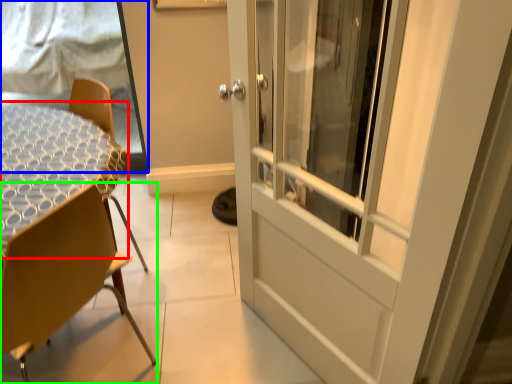
Question: Based on their relative distances, which object is nearer to round table (highlighted by a red box)? Choose from window screen (highlighted by a blue box) and chair (highlighted by a green box).

Choices:
 (A) window screen
 (B) chair

Answer: (B)